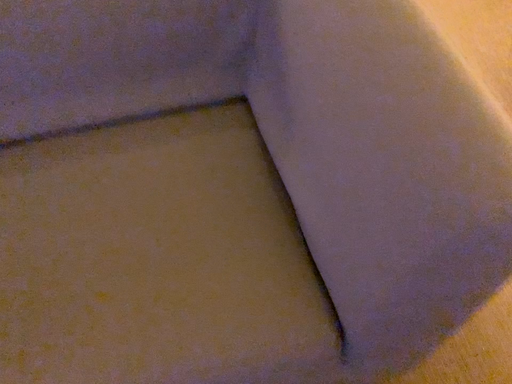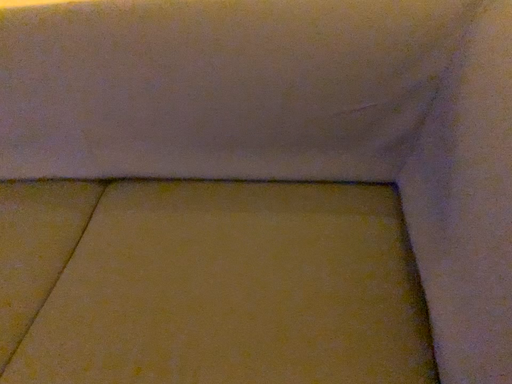
Question: How did the camera likely rotate when shooting the video?

Choices:
 (A) rotated left
 (B) rotated right

Answer: (A)